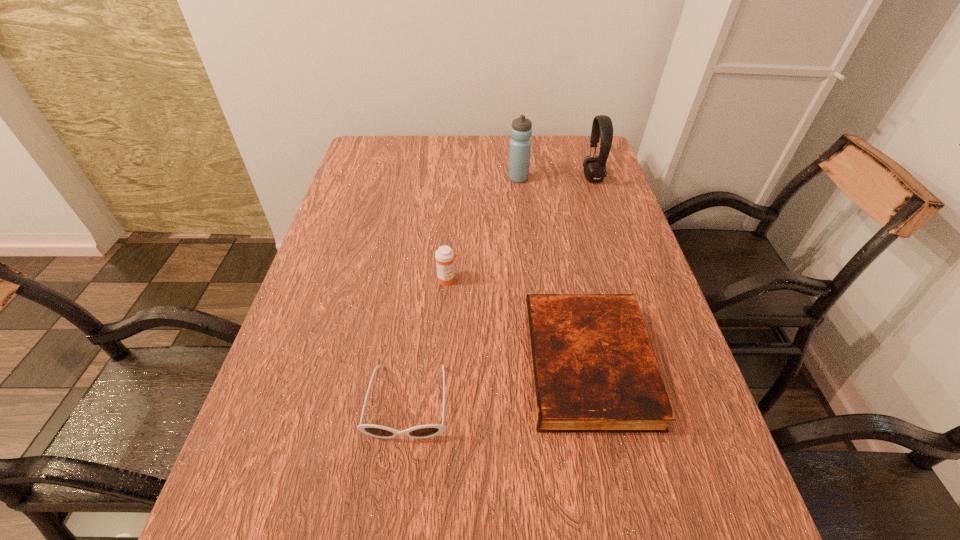
Image resolution: width=960 pixels, height=540 pixels. In order to click on vacant area at the left edge in this screenshot , I will do `click(326, 320)`.

The height and width of the screenshot is (540, 960). I want to click on vacant position at the right edge of the desktop, so click(648, 438).

In the image, there is a desktop. Identify the location of vacant space at the far left corner. (372, 136).

At what (x,y) coordinates should I click in order to perform the action: click on free point at the far right corner. Please return your answer as a coordinate pair (x, y). Looking at the image, I should click on (583, 158).

This screenshot has height=540, width=960. In order to click on free area in between the Bible and the headset in this screenshot , I will do (590, 271).

I want to click on vacant point located between the headset and the sunglasses, so click(x=500, y=290).

Locate an element on the screen. The width and height of the screenshot is (960, 540). vacant space in between the medicine and the Bible is located at coordinates (518, 322).

Where is `unoccupied area between the headset and the third tallest object`? Image resolution: width=960 pixels, height=540 pixels. unoccupied area between the headset and the third tallest object is located at coordinates (520, 229).

You are a GUI agent. You are given a task and a screenshot of the screen. Output one action in this format:
    pyautogui.click(x=<x>, y=<y>)
    Task: Click on the free space that is in between the water bottle and the medicine
    Image resolution: width=960 pixels, height=540 pixels.
    Given the screenshot: What is the action you would take?
    pyautogui.click(x=483, y=229)

The width and height of the screenshot is (960, 540). What are the coordinates of `unoccupied position between the headset and the third nearest object` in the screenshot? It's located at (520, 229).